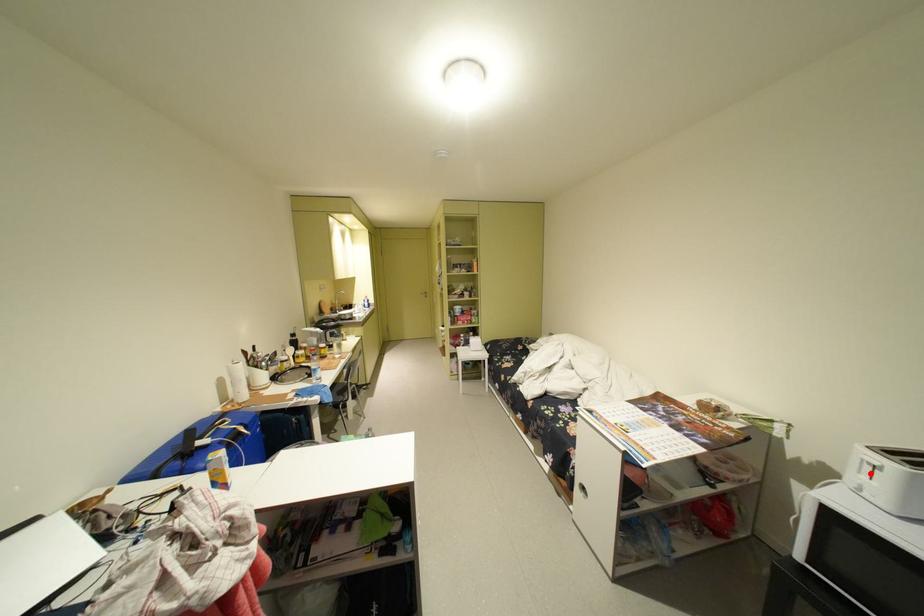
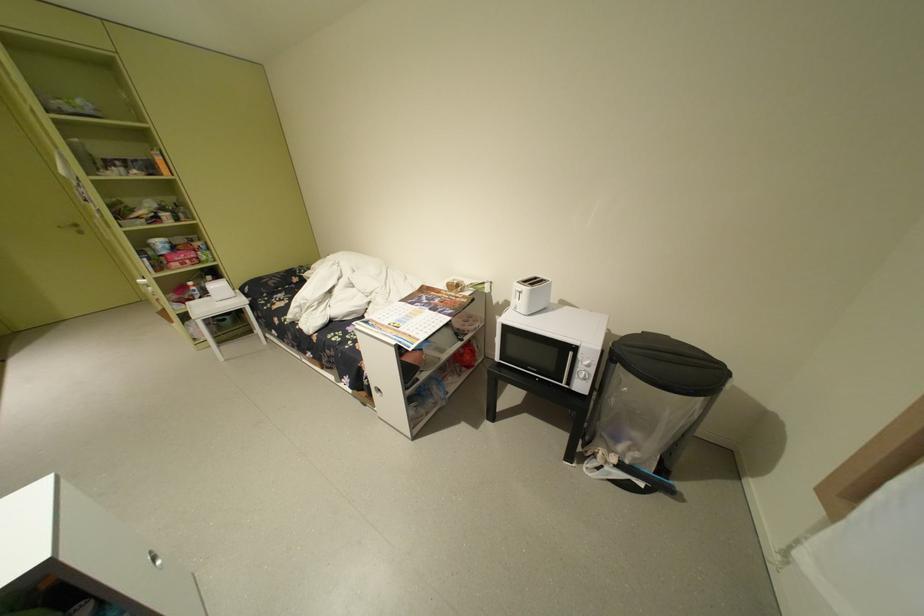
Question: I am providing you with two images of the same scene from different viewpoints. Given a red point in image1, look at the same physical point in image2. Is it:

Choices:
 (A) Closer to the viewpoint
 (B) Farther from the viewpoint

Answer: (A)